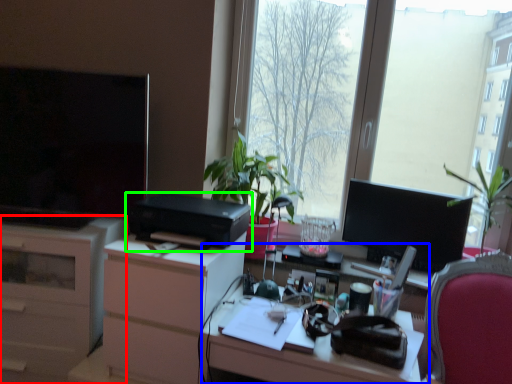
Question: Which object is the farthest from cabinetry (highlighted by a red box)? Choose among these: computer desk (highlighted by a blue box) or printer (highlighted by a green box).

Choices:
 (A) computer desk
 (B) printer

Answer: (A)